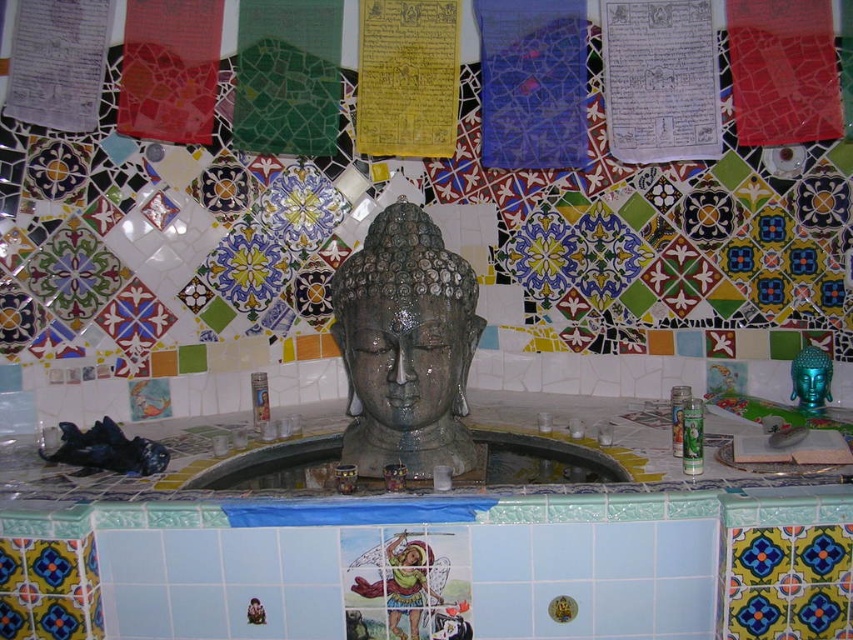
Is slate gray stone buddha head at center above yellow paper at upper center?

No.

Who is higher up, slate gray stone buddha head at center or yellow paper at upper center?

yellow paper at upper center

The width and height of the screenshot is (853, 640). In order to click on slate gray stone buddha head at center in this screenshot , I will do `click(405, 346)`.

Which of these two, slate stone buddha head at center or yellow paper at upper center, stands shorter?

yellow paper at upper center

Does slate stone buddha head at center come in front of yellow paper at upper center?

Yes.

This screenshot has height=640, width=853. Find the location of `slate stone buddha head at center`. slate stone buddha head at center is located at coordinates (405, 378).

You are a GUI agent. You are given a task and a screenshot of the screen. Output one action in this format:
    pyautogui.click(x=<x>, y=<y>)
    Task: Click on the slate stone buddha head at center
    
    Given the screenshot: What is the action you would take?
    pyautogui.click(x=405, y=378)

Is slate stone buddha head at center wider than slate gray stone buddha head at center?

Indeed, slate stone buddha head at center has a greater width compared to slate gray stone buddha head at center.

What do you see at coordinates (405, 378) in the screenshot? The height and width of the screenshot is (640, 853). I see `slate stone buddha head at center` at bounding box center [405, 378].

Is point (422, 264) more distant than point (473, 328)?

No, it is in front of (473, 328).

You are a GUI agent. You are given a task and a screenshot of the screen. Output one action in this format:
    pyautogui.click(x=<x>, y=<y>)
    Task: Click on the slate stone buddha head at center
    
    Given the screenshot: What is the action you would take?
    pyautogui.click(x=405, y=378)